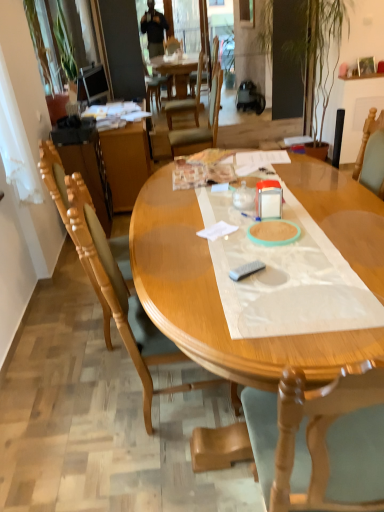
Where is `free space that is to the left of metallic silver container at center`? The height and width of the screenshot is (512, 384). free space that is to the left of metallic silver container at center is located at coordinates (230, 215).